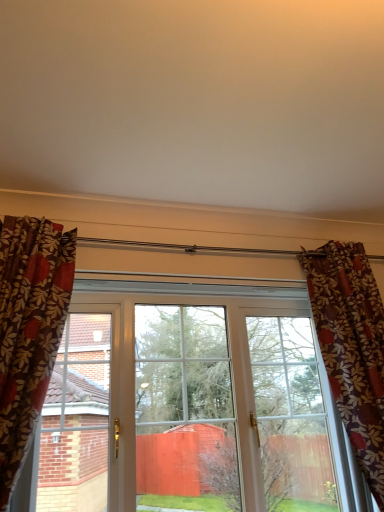
Question: Does white plastic window at center have a lesser width compared to floral fabric curtain at right?

Choices:
 (A) yes
 (B) no

Answer: (A)

Question: From a real-world perspective, does white plastic window at center sit lower than floral fabric curtain at right?

Choices:
 (A) yes
 (B) no

Answer: (A)

Question: Is the surface of white plastic window at center in direct contact with floral fabric curtain at right?

Choices:
 (A) no
 (B) yes

Answer: (A)

Question: Is white plastic window at center bigger than floral fabric curtain at right?

Choices:
 (A) no
 (B) yes

Answer: (A)

Question: Does white plastic window at center lie behind floral fabric curtain at right?

Choices:
 (A) yes
 (B) no

Answer: (A)

Question: Is white plastic window at center in front of floral fabric curtain at right?

Choices:
 (A) yes
 (B) no

Answer: (B)

Question: Does floral fabric curtain at right turn towards white plastic window at center?

Choices:
 (A) yes
 (B) no

Answer: (B)

Question: Is floral fabric curtain at right behind white plastic window at center?

Choices:
 (A) yes
 (B) no

Answer: (B)

Question: Is floral fabric curtain at right not inside white plastic window at center?

Choices:
 (A) no
 (B) yes

Answer: (B)

Question: Is floral fabric curtain at right next to white plastic window at center?

Choices:
 (A) yes
 (B) no

Answer: (B)

Question: Is floral fabric curtain at right at the right side of white plastic window at center?

Choices:
 (A) no
 (B) yes

Answer: (B)

Question: From a real-world perspective, is floral fabric curtain at right on top of white plastic window at center?

Choices:
 (A) yes
 (B) no

Answer: (A)

Question: Considering the positions of point (370, 480) and point (160, 396), is point (370, 480) closer or farther from the camera than point (160, 396)?

Choices:
 (A) farther
 (B) closer

Answer: (B)